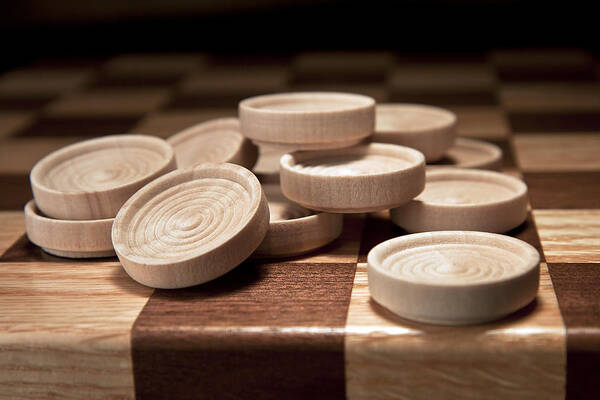
Locate an element on the screen. brown hardwood square is located at coordinates (279, 293).